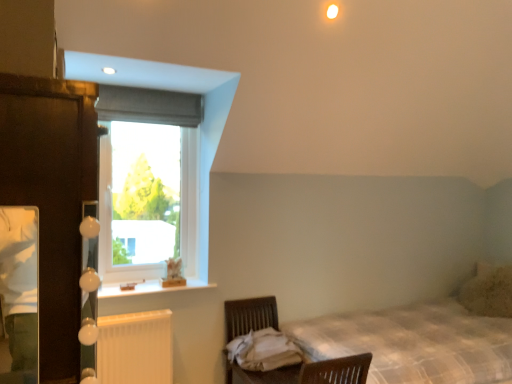
Question: Looking at the image, does white plastic radiator at lower left seem bigger or smaller compared to dark wood armoire at left?

Choices:
 (A) small
 (B) big

Answer: (A)

Question: From the image's perspective, relative to dark wood armoire at left, is white plastic radiator at lower left above or below?

Choices:
 (A) below
 (B) above

Answer: (A)

Question: Which object is the farthest from the white wood at upper left?

Choices:
 (A) clear glass window at upper left
 (B) white plastic radiator at lower left
 (C) wooden swivel chair at lower center
 (D) dark wood armoire at left
 (E) plaid fabric bed at lower right

Answer: (D)

Question: Which object is the farthest from the clear glass window at upper left?

Choices:
 (A) white plastic radiator at lower left
 (B) dark wood armoire at left
 (C) wooden swivel chair at lower center
 (D) plaid fabric bed at lower right
 (E) beige textured pillow at right

Answer: (E)